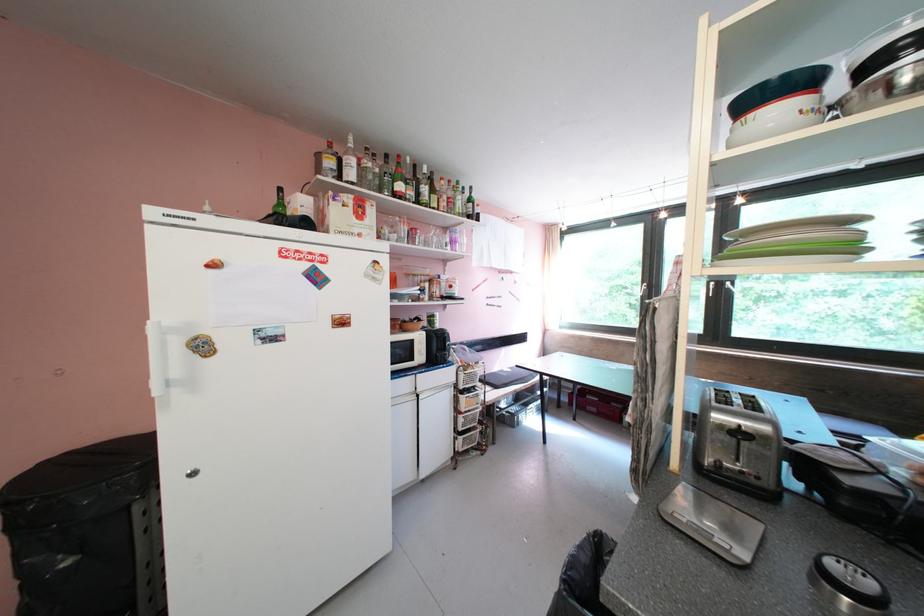
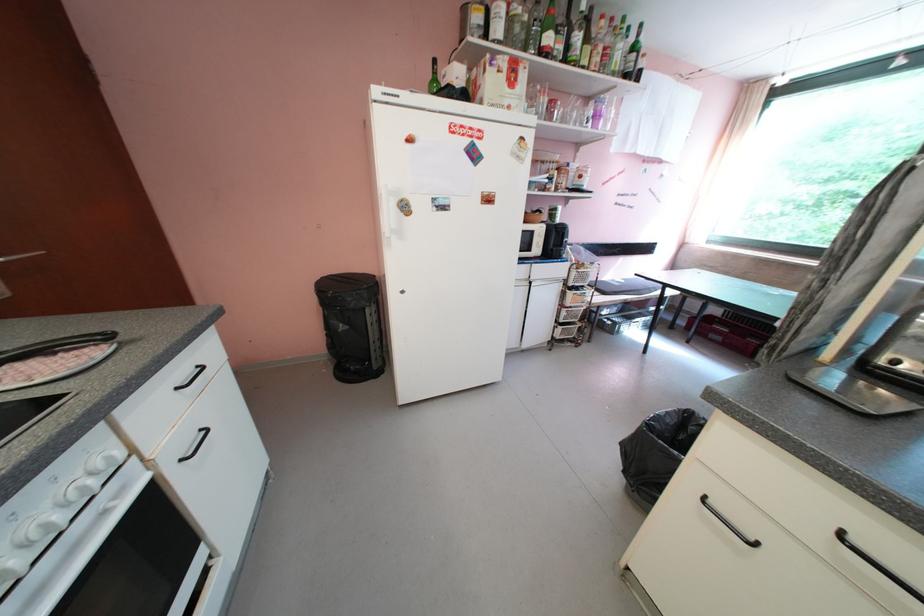
The point at (434, 245) is marked in the first image. Where is the corresponding point in the second image?

(572, 122)